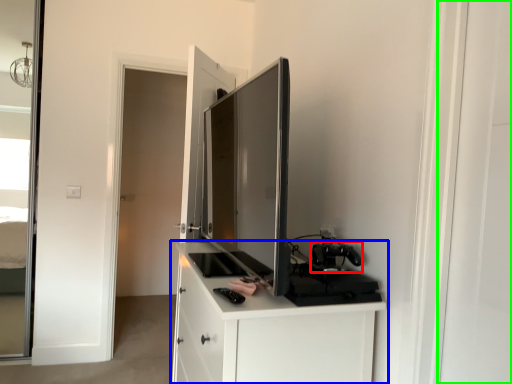
Question: Which object is positioned closest to appliance (highlighted by a red box)? Select from cabinetry (highlighted by a blue box) and screen door (highlighted by a green box).

Choices:
 (A) cabinetry
 (B) screen door

Answer: (A)